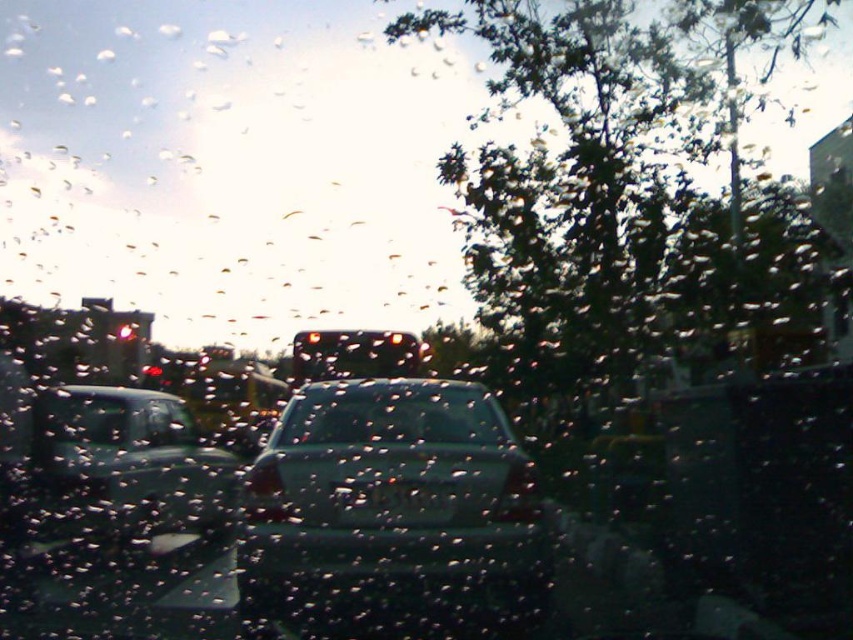
You are driving a car and need to determine if there is enough space to safely pass between the green leafy tree at upper right and the satin black sedan at left. The minimum safe distance required for passing is 30 feet. Can you safely pass between them?

The distance between the green leafy tree at upper right and the satin black sedan at left is 33.46 feet, which exceeds the minimum safe distance of 30 feet. Therefore, you can safely pass between them.

You are driving a car and notice a white plastic license plate at center. Where exactly is this license plate located relative to the point marked at coordinates (393, 502)?

The white plastic license plate at center is located exactly at the point marked by the coordinates (393, 502).